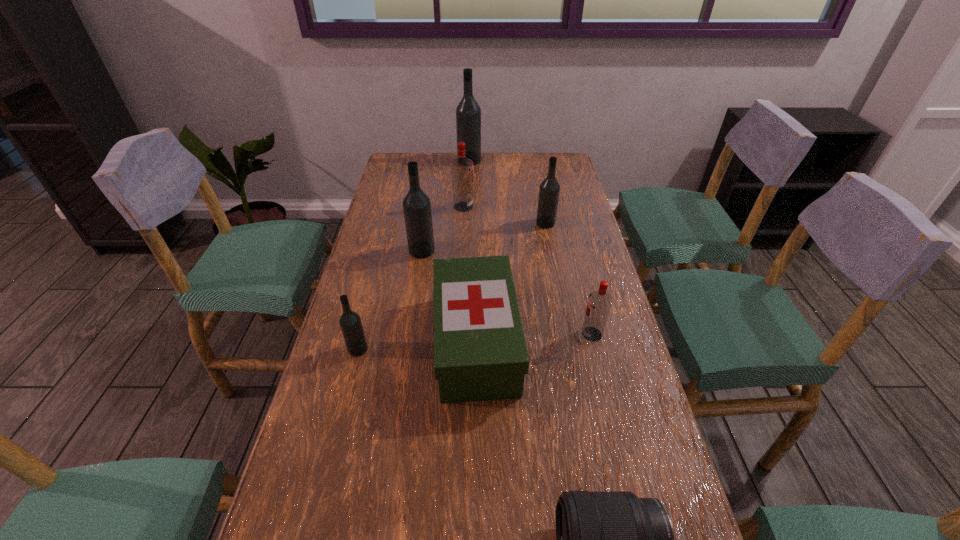
At what (x,y) coordinates should I click in order to perform the action: click on the smallest black vodka. Please return your answer as a coordinate pair (x, y). Looking at the image, I should click on (350, 322).

This screenshot has height=540, width=960. Identify the location of the nearest black vodka. (350, 322).

Locate an element on the screen. The width and height of the screenshot is (960, 540). green first-aid kit is located at coordinates (480, 353).

Locate an element on the screen. blank area located on the front of the farthest black vodka is located at coordinates (468, 189).

Find the location of a particular element. vacant region located 0.070m on the back of the third farthest black vodka is located at coordinates (425, 230).

Image resolution: width=960 pixels, height=540 pixels. Find the location of `vacant region located 0.330m on the front label of the second farthest vodka`. vacant region located 0.330m on the front label of the second farthest vodka is located at coordinates (566, 207).

Identify the location of vacant area situated on the front of the rightmost black vodka. The height and width of the screenshot is (540, 960). (563, 311).

Where is `vacant area situated on the front label of the rightmost vodka`? The image size is (960, 540). vacant area situated on the front label of the rightmost vodka is located at coordinates (507, 334).

Image resolution: width=960 pixels, height=540 pixels. Find the location of `vacant space situated on the front label of the rightmost vodka`. vacant space situated on the front label of the rightmost vodka is located at coordinates (448, 334).

The height and width of the screenshot is (540, 960). What are the coordinates of `vacant position located 0.370m on the front label of the rightmost vodka` in the screenshot? It's located at (437, 334).